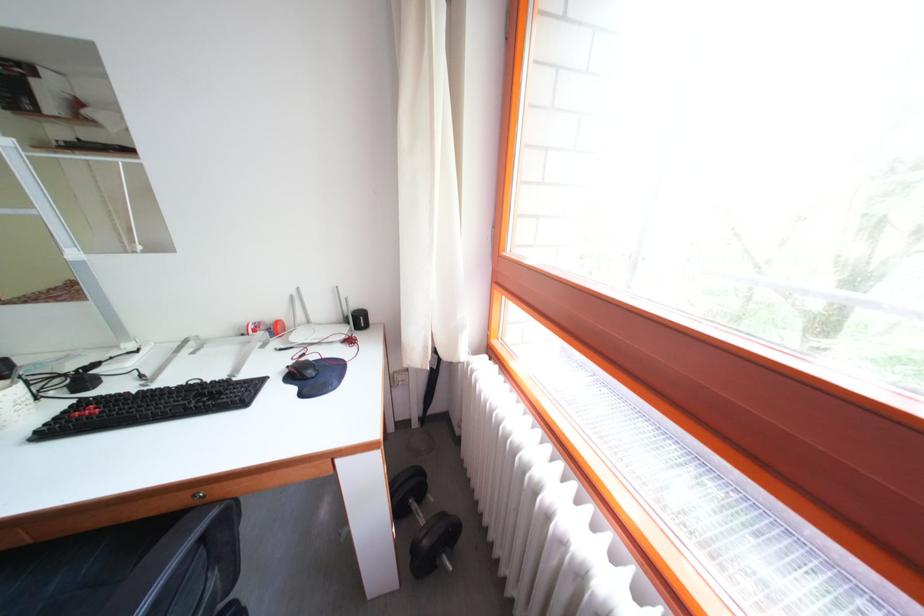
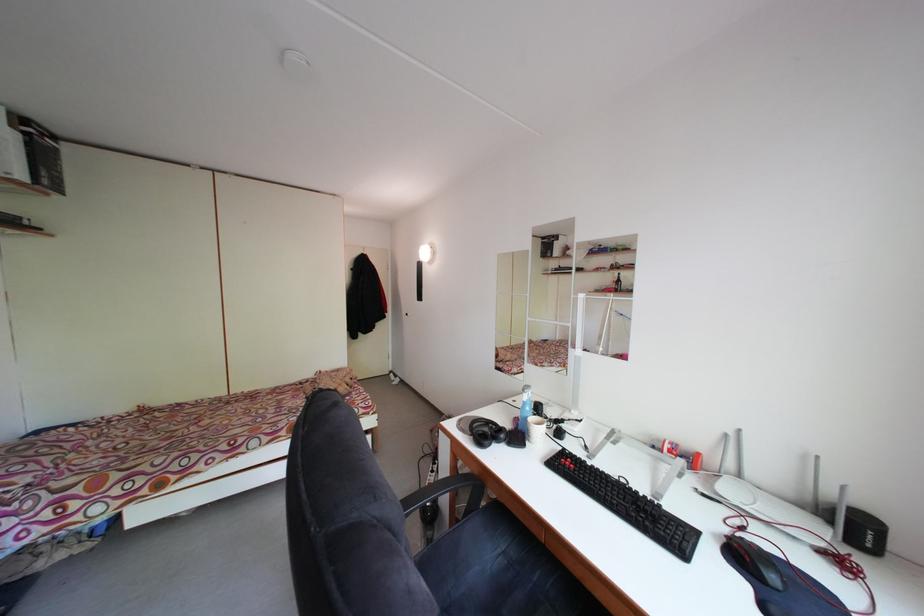
Locate, in the second image, the point that corresponds to pixel 300 302 in the first image.

(735, 442)